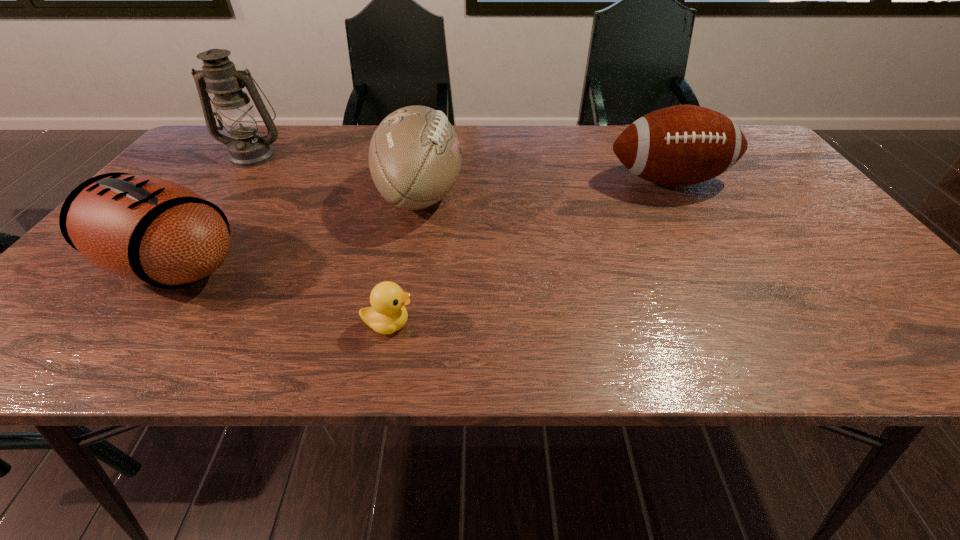
Identify the location of oil lamp located at the far edge. This screenshot has width=960, height=540. (235, 113).

The width and height of the screenshot is (960, 540). Identify the location of object situated at the near edge. (388, 314).

Where is `oil lamp that is at the left edge`? This screenshot has width=960, height=540. oil lamp that is at the left edge is located at coordinates (235, 113).

Identify the location of football (American) that is positioned at the left edge. The height and width of the screenshot is (540, 960). (144, 229).

Where is `object that is at the far left corner`? The height and width of the screenshot is (540, 960). object that is at the far left corner is located at coordinates pos(235,113).

Locate an element on the screen. This screenshot has height=540, width=960. free region at the far edge of the desktop is located at coordinates (509, 133).

In order to click on vacant space at the near edge of the desktop in this screenshot , I will do `click(145, 347)`.

In the image, there is a desktop. Where is `vacant space at the right edge`? The height and width of the screenshot is (540, 960). vacant space at the right edge is located at coordinates (751, 202).

This screenshot has height=540, width=960. What are the coordinates of `vacant area that lies between the duck and the rightmost object` in the screenshot? It's located at (528, 253).

Where is `blank region between the rightmost football (American) and the leftmost football (American)`? blank region between the rightmost football (American) and the leftmost football (American) is located at coordinates (420, 224).